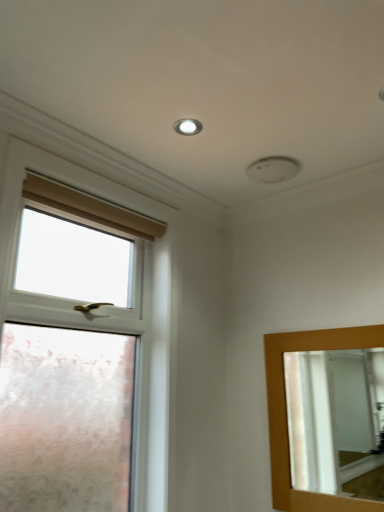
Question: Is matte white droplight at upper center at the left side of wooden-framed mirror at right?

Choices:
 (A) no
 (B) yes

Answer: (B)

Question: Is matte white droplight at upper center thinner than wooden-framed mirror at right?

Choices:
 (A) yes
 (B) no

Answer: (B)

Question: Is matte white droplight at upper center further to camera compared to wooden-framed mirror at right?

Choices:
 (A) no
 (B) yes

Answer: (B)

Question: Are matte white droplight at upper center and wooden-framed mirror at right located far from each other?

Choices:
 (A) no
 (B) yes

Answer: (B)

Question: From the image's perspective, is matte white droplight at upper center located beneath wooden-framed mirror at right?

Choices:
 (A) yes
 (B) no

Answer: (B)

Question: Is matte white droplight at upper center oriented away from wooden-framed mirror at right?

Choices:
 (A) no
 (B) yes

Answer: (A)

Question: From the image's perspective, is wooden-framed mirror at right located beneath matte white droplight at upper center?

Choices:
 (A) yes
 (B) no

Answer: (A)

Question: From the image's perspective, is wooden-framed mirror at right on matte white droplight at upper center?

Choices:
 (A) yes
 (B) no

Answer: (B)

Question: Does wooden-framed mirror at right have a larger size compared to matte white droplight at upper center?

Choices:
 (A) no
 (B) yes

Answer: (B)

Question: Is there a large distance between wooden-framed mirror at right and matte white droplight at upper center?

Choices:
 (A) yes
 (B) no

Answer: (A)

Question: Does wooden-framed mirror at right have a smaller size compared to matte white droplight at upper center?

Choices:
 (A) yes
 (B) no

Answer: (B)

Question: Is wooden-framed mirror at right aimed at matte white droplight at upper center?

Choices:
 (A) yes
 (B) no

Answer: (B)

Question: Considering the relative positions of wooden-framed mirror at right and white frosted glass window at left in the image provided, is wooden-framed mirror at right to the right of white frosted glass window at left from the viewer's perspective?

Choices:
 (A) yes
 (B) no

Answer: (A)